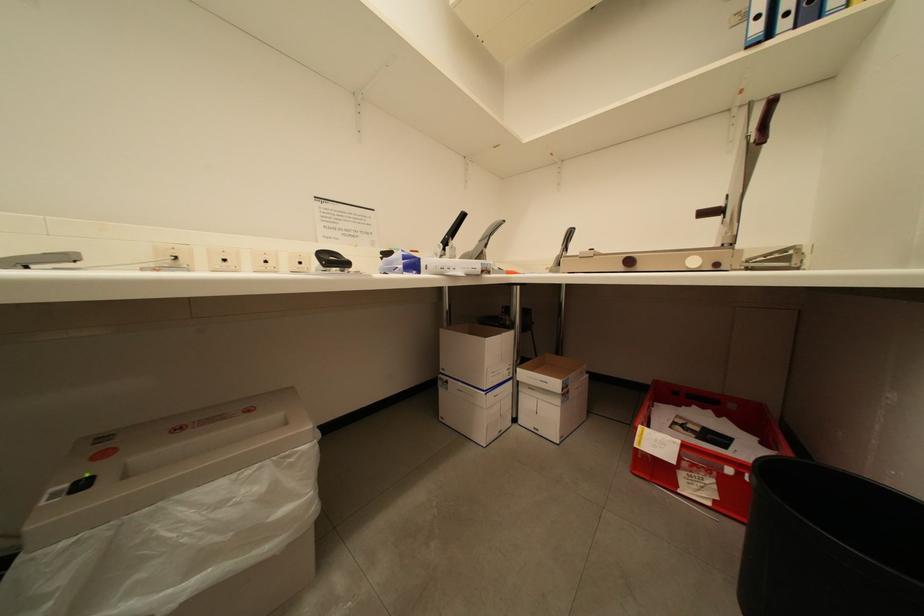
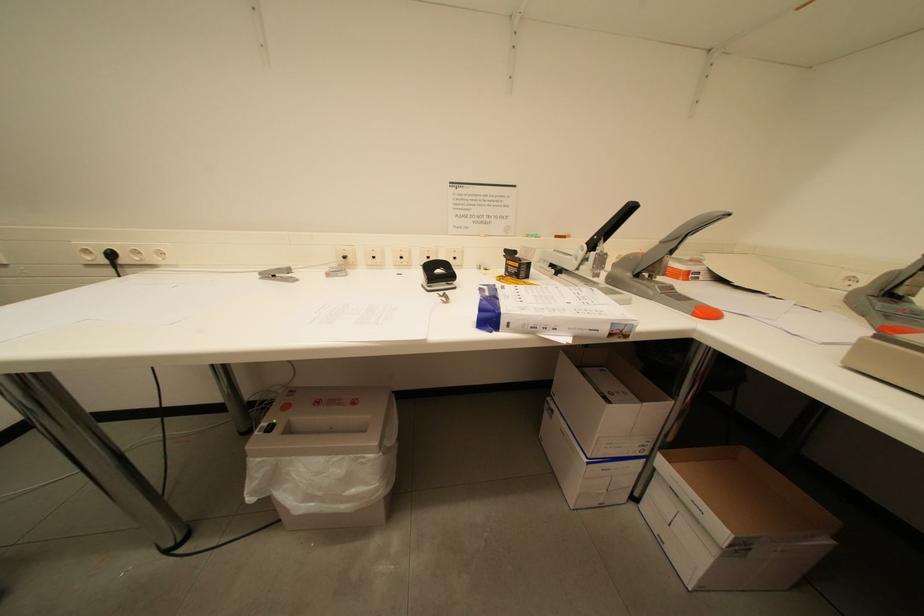
The images are taken continuously from a first-person perspective. In which direction is your viewpoint rotating?

The camera's rotation is toward left-down.